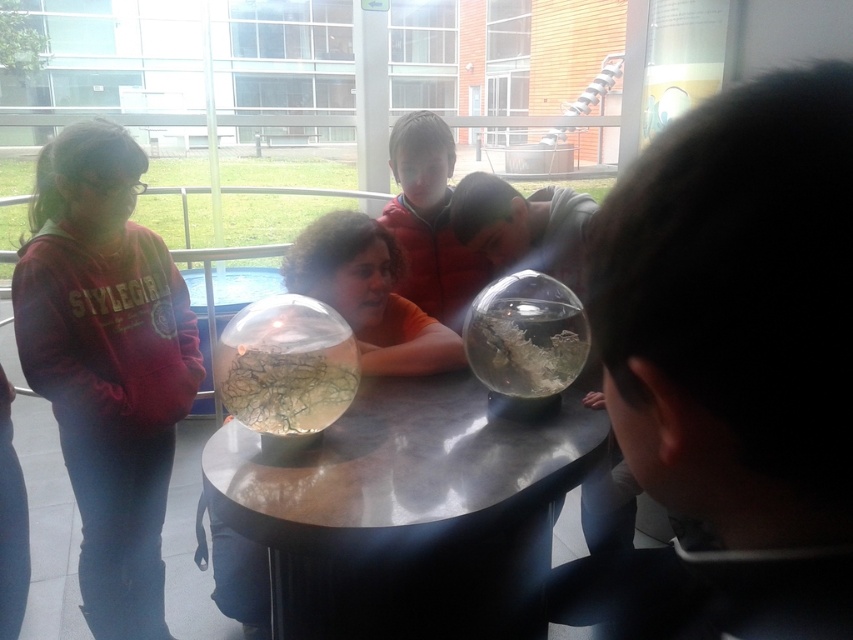
Question: Is transparent glass sphere at center bigger than matte orange jacket at center?

Choices:
 (A) yes
 (B) no

Answer: (B)

Question: Which object is positioned closest to the metallic reflective table at center?

Choices:
 (A) matte orange jacket at center
 (B) transparent glass sphere at center

Answer: (B)

Question: From the image, what is the correct spatial relationship of matte orange shirt at center in relation to matte orange jacket at center?

Choices:
 (A) below
 (B) above

Answer: (A)

Question: Does matte orange jacket at center have a lesser width compared to translucent glass food at center?

Choices:
 (A) no
 (B) yes

Answer: (A)

Question: Estimate the real-world distances between objects in this image. Which object is closer to the translucent glass food at center?

Choices:
 (A) matte orange shirt at center
 (B) translucent glass bowl at center
 (C) matte orange jacket at center
 (D) transparent glass sphere at center

Answer: (D)

Question: Which point is closer to the camera?

Choices:
 (A) (426, 296)
 (B) (300, 432)

Answer: (B)